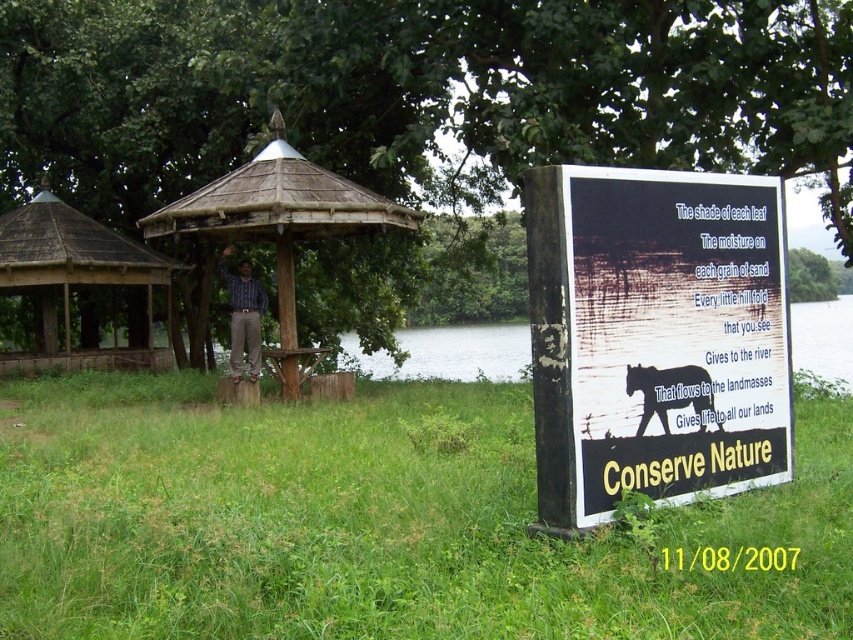
Is green grassy at right wider than wooden gazebo at center?

Yes.

The width and height of the screenshot is (853, 640). I want to click on green grassy at right, so click(376, 522).

Which of these two, wooden gazebo at center or silhouette glossy black bear at right, stands taller?

Standing taller between the two is wooden gazebo at center.

Is point (177, 209) positioned before point (685, 387)?

No, it is not.

Find the location of `wooden gazebo at center`. wooden gazebo at center is located at coordinates (277, 212).

Find the location of a particular element. Image resolution: width=853 pixels, height=640 pixels. wooden gazebo at center is located at coordinates (277, 212).

Which of these two, black wood sign at right or wooden gazebo at center, stands taller?

With more height is black wood sign at right.

Is black wood sign at right to the left of wooden gazebo at center from the viewer's perspective?

Incorrect, black wood sign at right is not on the left side of wooden gazebo at center.

The width and height of the screenshot is (853, 640). Identify the location of black wood sign at right. (654, 337).

Image resolution: width=853 pixels, height=640 pixels. I want to click on black wood sign at right, so click(x=654, y=337).